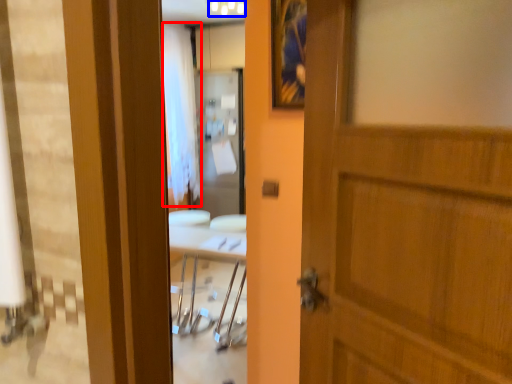
Question: Which object appears closest to the camera in this image, curtain (highlighted by a red box) or light fixture (highlighted by a blue box)?

Choices:
 (A) curtain
 (B) light fixture

Answer: (B)